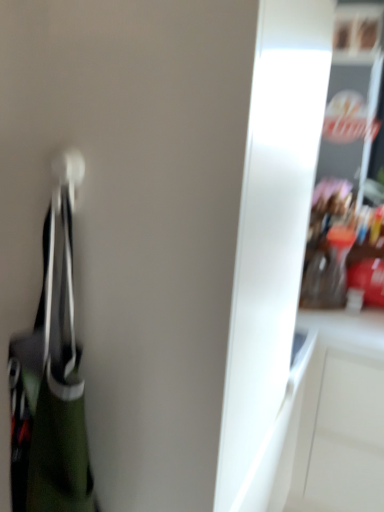
Question: Is white glossy cabinet at right facing towards green fabric handbag at left?

Choices:
 (A) no
 (B) yes

Answer: (B)

Question: From a real-world perspective, is white glossy cabinet at right on green fabric handbag at left?

Choices:
 (A) no
 (B) yes

Answer: (A)

Question: From a real-world perspective, is white glossy cabinet at right below green fabric handbag at left?

Choices:
 (A) yes
 (B) no

Answer: (A)

Question: Does white glossy cabinet at right have a larger size compared to green fabric handbag at left?

Choices:
 (A) yes
 (B) no

Answer: (A)

Question: Is green fabric handbag at left completely or partially inside white glossy cabinet at right?

Choices:
 (A) no
 (B) yes

Answer: (A)

Question: Does white glossy cabinet at right have a greater width compared to green fabric handbag at left?

Choices:
 (A) yes
 (B) no

Answer: (A)

Question: Considering the relative positions of green fabric handbag at left and white glossy cabinet at right in the image provided, is green fabric handbag at left to the right of white glossy cabinet at right from the viewer's perspective?

Choices:
 (A) yes
 (B) no

Answer: (B)

Question: Considering the relative sizes of green fabric handbag at left and white glossy cabinet at right in the image provided, is green fabric handbag at left taller than white glossy cabinet at right?

Choices:
 (A) yes
 (B) no

Answer: (B)

Question: Can you confirm if green fabric handbag at left is thinner than white glossy cabinet at right?

Choices:
 (A) no
 (B) yes

Answer: (B)

Question: Is green fabric handbag at left positioned before white glossy cabinet at right?

Choices:
 (A) no
 (B) yes

Answer: (B)

Question: Is green fabric handbag at left positioned far away from white glossy cabinet at right?

Choices:
 (A) yes
 (B) no

Answer: (A)

Question: Does green fabric handbag at left touch white glossy cabinet at right?

Choices:
 (A) yes
 (B) no

Answer: (B)

Question: Looking at their shapes, would you say white glossy cabinet at right is wider or thinner than green fabric handbag at left?

Choices:
 (A) wide
 (B) thin

Answer: (A)